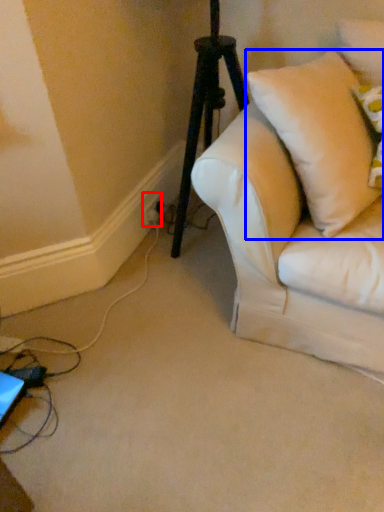
Question: Which of the following is the closest to the observer, electric outlet (highlighted by a red box) or pillow (highlighted by a blue box)?

Choices:
 (A) electric outlet
 (B) pillow

Answer: (B)